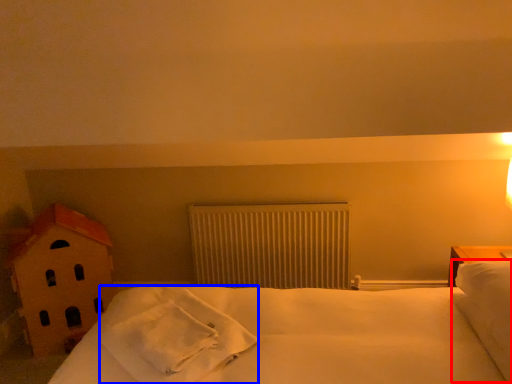
Question: Which point is closer to the camera, pillow (highlighted by a red box) or material (highlighted by a blue box)?

Choices:
 (A) pillow
 (B) material

Answer: (A)